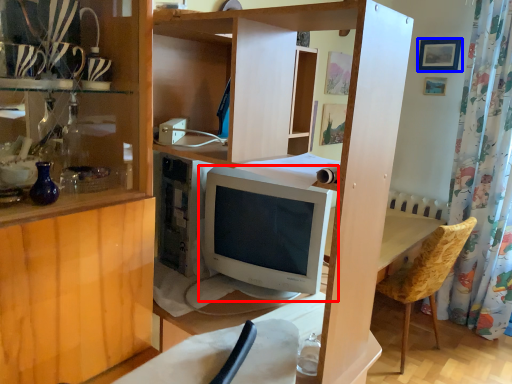
Question: Which of the following is the closest to the observer, computer monitor (highlighted by a red box) or picture frame (highlighted by a blue box)?

Choices:
 (A) computer monitor
 (B) picture frame

Answer: (A)